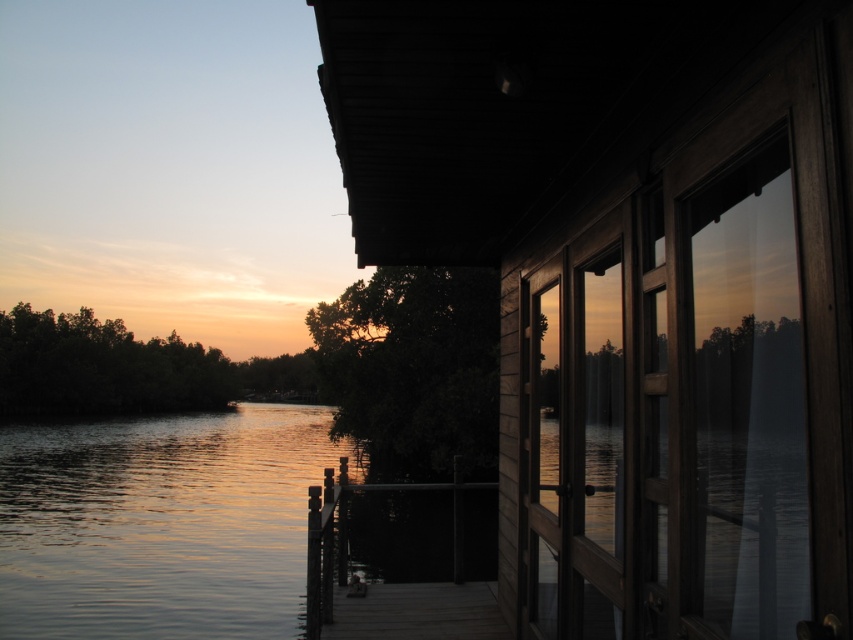
Question: Based on their relative distances, which object is farther from the wooden cabin at right?

Choices:
 (A) wooden dock at center
 (B) glistening water at lower left

Answer: (B)

Question: Can you confirm if glistening water at lower left is positioned to the right of wooden dock at center?

Choices:
 (A) no
 (B) yes

Answer: (A)

Question: Does wooden cabin at right appear on the left side of wooden dock at center?

Choices:
 (A) no
 (B) yes

Answer: (A)

Question: Which point appears farthest from the camera in this image?

Choices:
 (A) (425, 616)
 (B) (573, 186)
 (C) (50, 596)

Answer: (C)

Question: Which object is the closest to the wooden cabin at right?

Choices:
 (A) glistening water at lower left
 (B) wooden dock at center

Answer: (B)

Question: Is glistening water at lower left closer to camera compared to wooden dock at center?

Choices:
 (A) no
 (B) yes

Answer: (A)